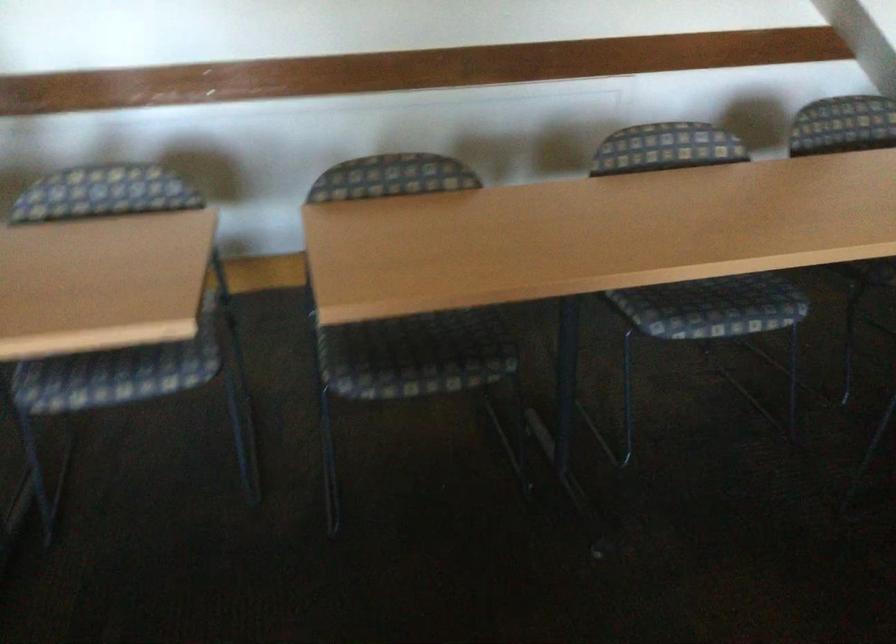
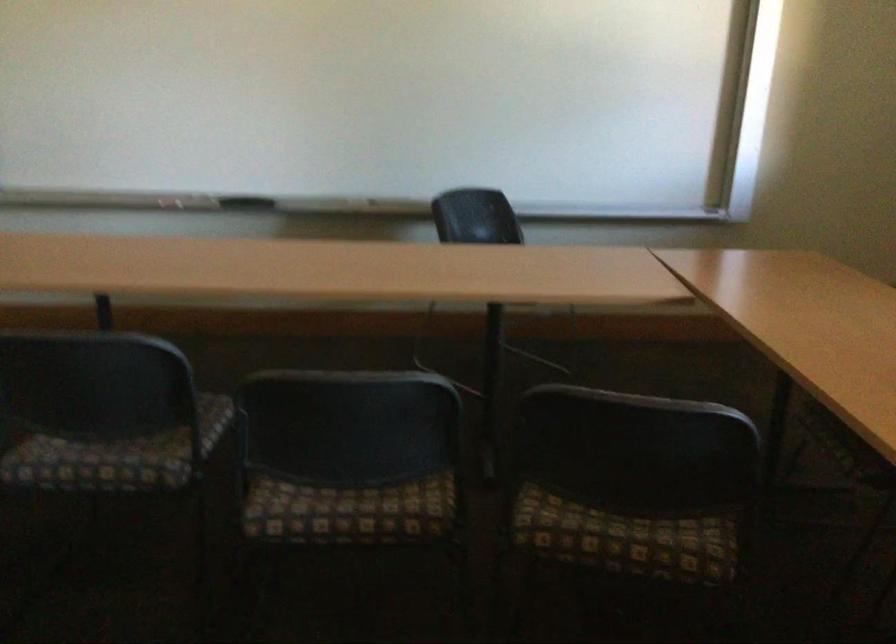
Question: How did the camera likely rotate?

Choices:
 (A) Left
 (B) Right
 (C) Up
 (D) Down

Answer: (B)